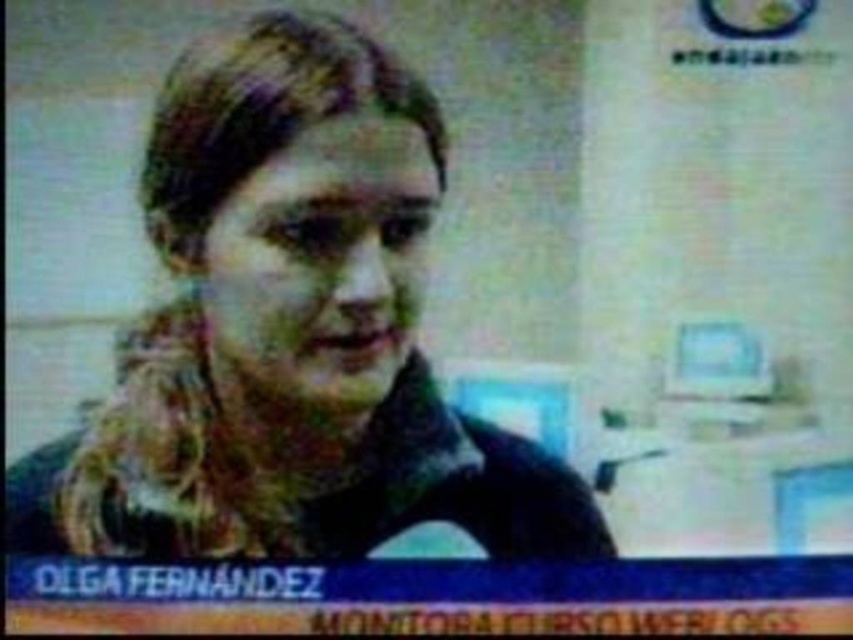
Can you confirm if dark brown hair at center is positioned below light blue plastic monitor at upper right?

Incorrect, dark brown hair at center is not positioned below light blue plastic monitor at upper right.

Between point (361, 163) and point (728, 355), which one is positioned in front?

Point (361, 163) is in front.

The width and height of the screenshot is (853, 640). What do you see at coordinates (289, 332) in the screenshot? I see `dark brown hair at center` at bounding box center [289, 332].

This screenshot has width=853, height=640. I want to click on dark brown hair at center, so click(x=289, y=332).

Is dark brown hair at center wider than smooth skin face at center?

Indeed, dark brown hair at center has a greater width compared to smooth skin face at center.

Which of these two, dark brown hair at center or smooth skin face at center, stands taller?

dark brown hair at center

Measure the distance between point [367,410] and camera.

A distance of 1.31 meters exists between point [367,410] and camera.

Find the location of a particular element. dark brown hair at center is located at coordinates (289, 332).

Does smooth skin face at center appear on the right side of light blue plastic monitor at upper right?

In fact, smooth skin face at center is to the left of light blue plastic monitor at upper right.

Is smooth skin face at center thinner than light blue plastic monitor at upper right?

Incorrect, smooth skin face at center's width is not less than light blue plastic monitor at upper right's.

Is point (265, 193) positioned before point (718, 392)?

Yes, it is.

You are a GUI agent. You are given a task and a screenshot of the screen. Output one action in this format:
    pyautogui.click(x=<x>, y=<y>)
    Task: Click on the smooth skin face at center
    This screenshot has width=853, height=640.
    Given the screenshot: What is the action you would take?
    pyautogui.click(x=320, y=266)